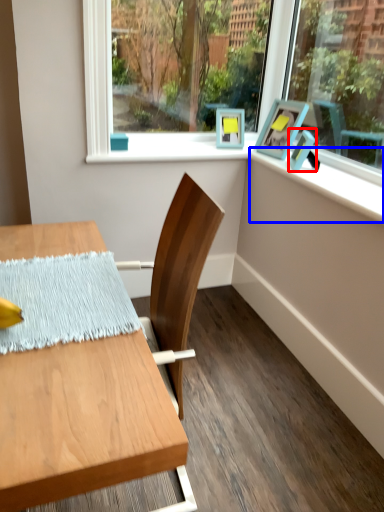
Question: Which point is further to the camera, picture frame (highlighted by a red box) or window sill (highlighted by a blue box)?

Choices:
 (A) picture frame
 (B) window sill

Answer: (A)